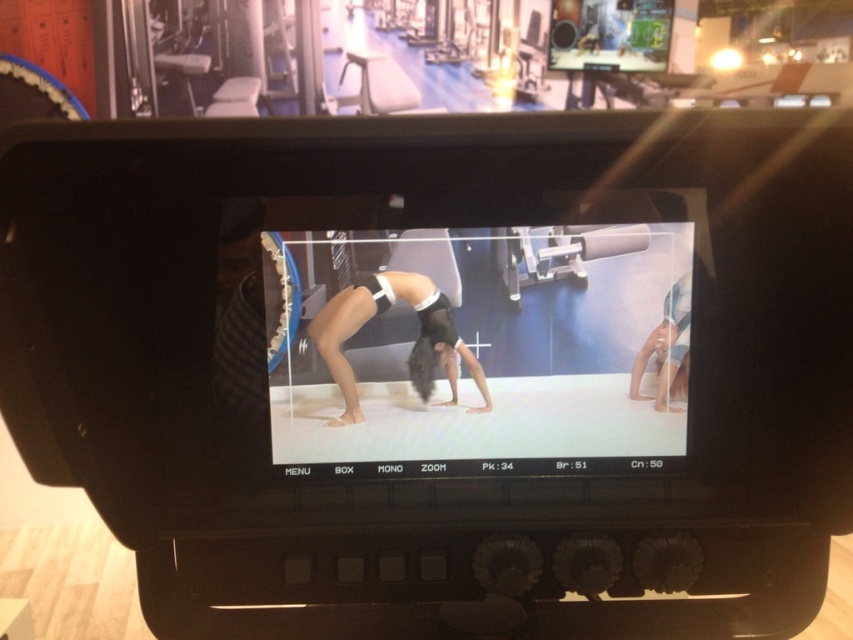
Can you confirm if black matte yoga mat at center is taller than smooth skin at lower right?

Indeed, black matte yoga mat at center has a greater height compared to smooth skin at lower right.

Locate an element on the screen. The width and height of the screenshot is (853, 640). black matte yoga mat at center is located at coordinates (489, 349).

This screenshot has height=640, width=853. I want to click on black matte yoga mat at center, so click(x=489, y=349).

Which is behind, point (375, 284) or point (680, 296)?

The point (680, 296) is more distant.

I want to click on black matte hair at center, so click(413, 344).

Locate an element on the screen. This screenshot has width=853, height=640. black matte hair at center is located at coordinates (413, 344).

Is point (532, 387) positioned after point (352, 372)?

Yes, it is behind point (352, 372).

How much distance is there between black matte yoga mat at center and black matte hair at center?

black matte yoga mat at center is 2.01 inches from black matte hair at center.

Between point (473, 435) and point (419, 390), which one is positioned behind?

Positioned behind is point (419, 390).

At what (x,y) coordinates should I click in order to perform the action: click on black matte yoga mat at center. Please return your answer as a coordinate pair (x, y). Image resolution: width=853 pixels, height=640 pixels. Looking at the image, I should click on (489, 349).